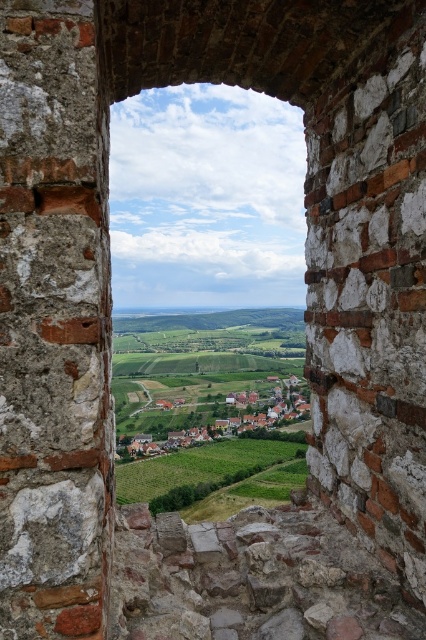
You are a tourist standing in front of the stone archway and looking at the green grassy field at center and the green grassy village at center. Which one appears taller from your perspective?

The green grassy field at center appears taller than the green grassy village at center because it is much taller as described.

You are a drone operator who needs to fly a drone from the green grassy field at center to the green grassy village at center. Given that the drone has a maximum flight range of 100 feet, can it make the trip without needing to recharge?

The green grassy field at center and green grassy village at center are 106.02 feet apart. Since the drone has a maximum flight range of 100 feet, it cannot make the trip without needing to recharge.